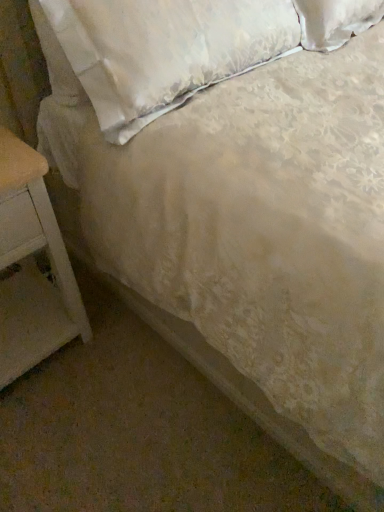
What is the approximate height of white wood nightstand at lower left?

The height of white wood nightstand at lower left is 26.24 inches.

This screenshot has height=512, width=384. Describe the element at coordinates (32, 267) in the screenshot. I see `white wood nightstand at lower left` at that location.

Find the location of a particular element. white wood nightstand at lower left is located at coordinates (32, 267).

Find the location of a particular element. Image resolution: width=384 pixels, height=512 pixels. white wood nightstand at lower left is located at coordinates (32, 267).